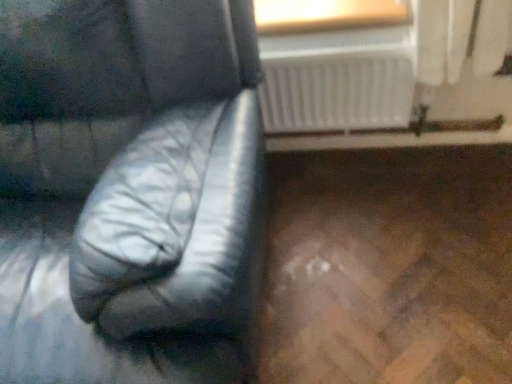
Question: In terms of size, does wooden frame at upper center appear bigger or smaller than black leather armchair at left?

Choices:
 (A) small
 (B) big

Answer: (A)

Question: Considering the positions of wooden frame at upper center and black leather armchair at left in the image, is wooden frame at upper center wider or thinner than black leather armchair at left?

Choices:
 (A) wide
 (B) thin

Answer: (B)

Question: Based on their relative distances, which object is farther from the black leather armchair at left?

Choices:
 (A) wooden frame at upper center
 (B) white plastic radiator at upper center

Answer: (A)

Question: Considering the real-world distances, which object is farthest from the wooden frame at upper center?

Choices:
 (A) white plastic radiator at upper center
 (B) black leather armchair at left

Answer: (B)